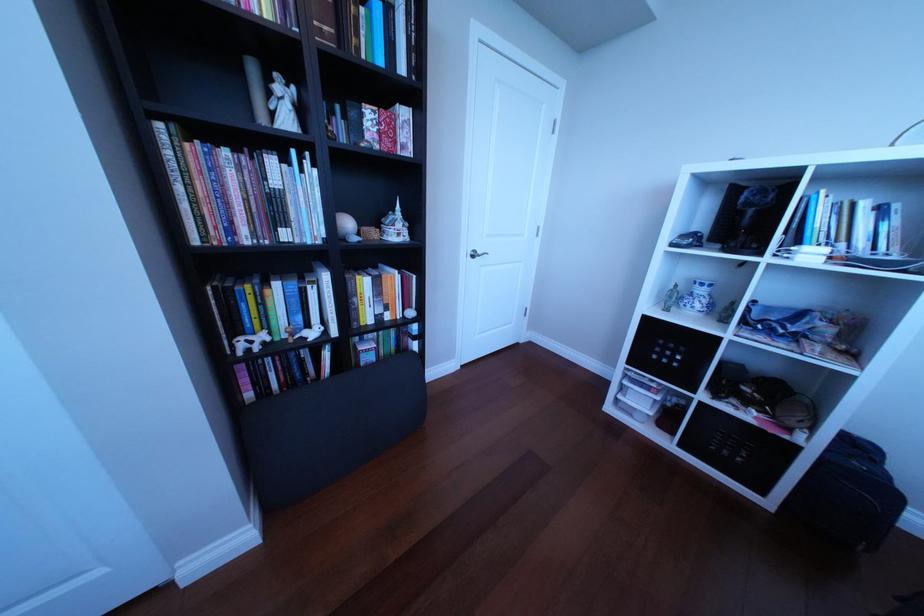
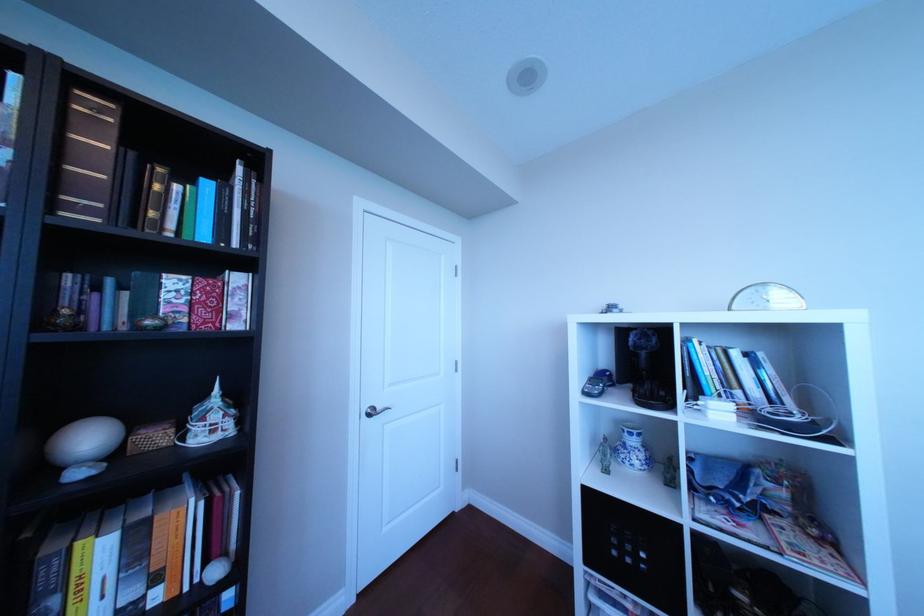
Question: The first image is from the beginning of the video and the second image is from the end. How did the camera likely rotate when shooting the video?

Choices:
 (A) Left
 (B) Right
 (C) Up
 (D) Down

Answer: (C)